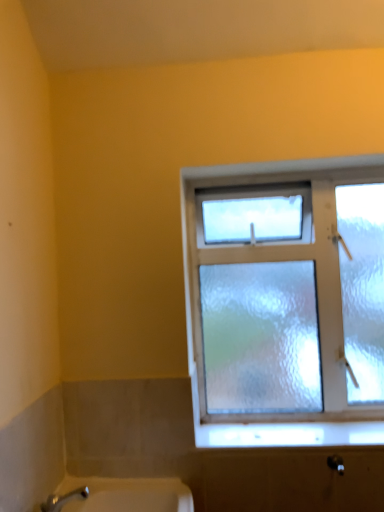
Question: Should I look upward or downward to see white frosted glass at lower center?

Choices:
 (A) down
 (B) up

Answer: (A)

Question: From a real-world perspective, is white frosted glass at lower center beneath frosted glass window at upper right?

Choices:
 (A) no
 (B) yes

Answer: (B)

Question: Is white frosted glass at lower center taller than frosted glass window at upper right?

Choices:
 (A) yes
 (B) no

Answer: (B)

Question: Is white frosted glass at lower center directly adjacent to frosted glass window at upper right?

Choices:
 (A) yes
 (B) no

Answer: (B)

Question: Can you confirm if white frosted glass at lower center is bigger than frosted glass window at upper right?

Choices:
 (A) yes
 (B) no

Answer: (B)

Question: Does white frosted glass at lower center lie behind frosted glass window at upper right?

Choices:
 (A) no
 (B) yes

Answer: (A)

Question: Can you confirm if white frosted glass at lower center is smaller than frosted glass window at upper right?

Choices:
 (A) no
 (B) yes

Answer: (B)

Question: From a real-world perspective, does frosted glass window at upper right stand above white frosted glass at lower center?

Choices:
 (A) yes
 (B) no

Answer: (A)

Question: Is frosted glass window at upper right not close to white frosted glass at lower center?

Choices:
 (A) yes
 (B) no

Answer: (B)

Question: Is frosted glass window at upper right smaller than white frosted glass at lower center?

Choices:
 (A) no
 (B) yes

Answer: (A)

Question: From the image's perspective, is frosted glass window at upper right above white frosted glass at lower center?

Choices:
 (A) yes
 (B) no

Answer: (A)

Question: From a real-world perspective, is frosted glass window at upper right located beneath white frosted glass at lower center?

Choices:
 (A) yes
 (B) no

Answer: (B)

Question: Would you say frosted glass window at upper right is outside white frosted glass at lower center?

Choices:
 (A) no
 (B) yes

Answer: (B)

Question: In terms of height, does frosted glass window at upper right look taller or shorter compared to white frosted glass at lower center?

Choices:
 (A) tall
 (B) short

Answer: (A)